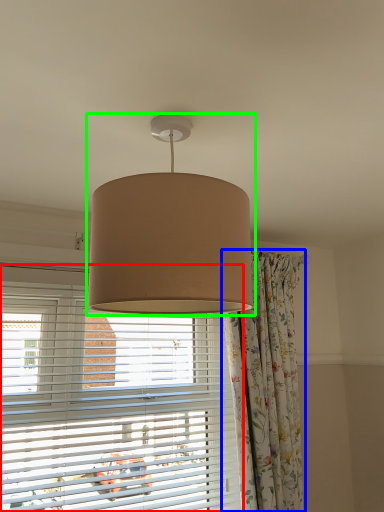
Question: Considering the real-world distances, which object is farthest from window blind (highlighted by a red box)? curtain (highlighted by a blue box) or lamp (highlighted by a green box)?

Choices:
 (A) curtain
 (B) lamp

Answer: (B)